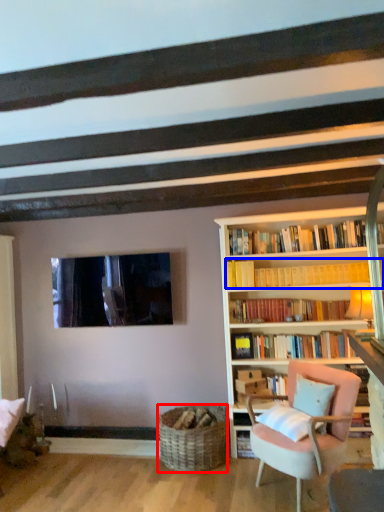
Question: Which object is further to the camera taking this photo, basket (highlighted by a red box) or book (highlighted by a blue box)?

Choices:
 (A) basket
 (B) book

Answer: (B)